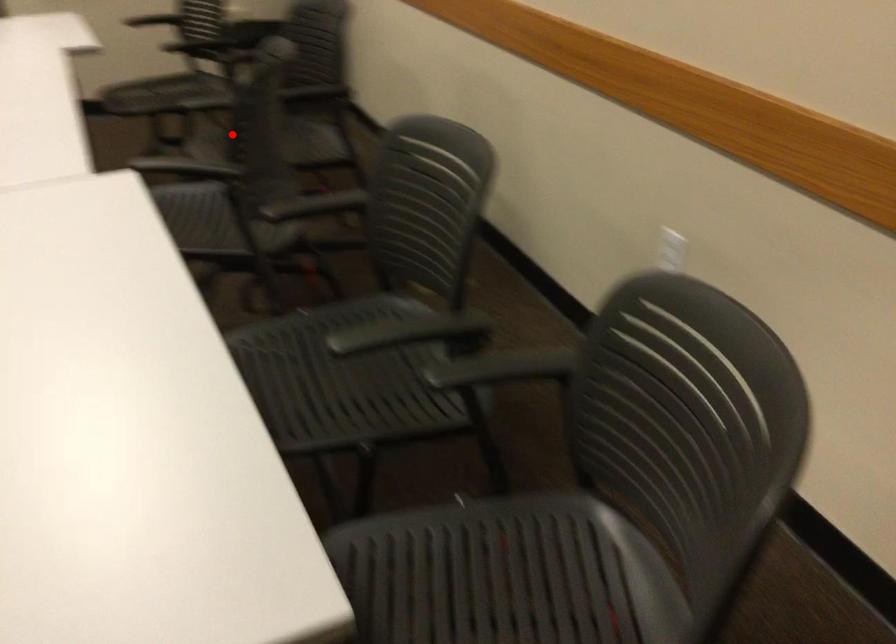
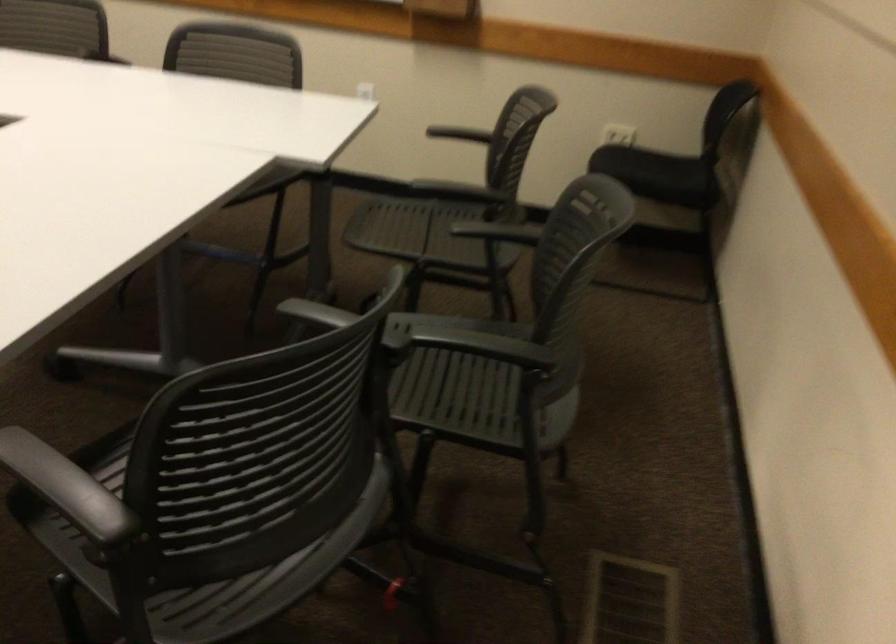
Question: I am providing you with two images of the same scene from different viewpoints. A red point is shown in image1. For the corresponding object point in image2, is it positioned nearer or farther from the camera?

Choices:
 (A) Nearer
 (B) Farther

Answer: (A)